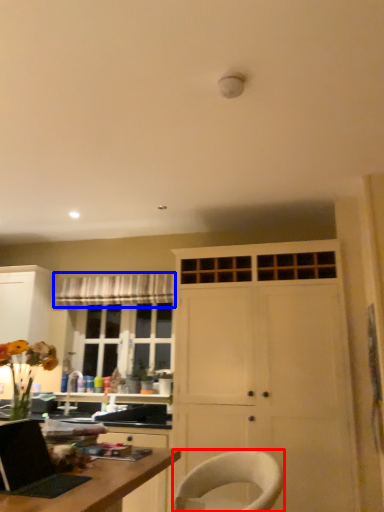
Question: Which object is further to the camera taking this photo, chair (highlighted by a red box) or curtain (highlighted by a blue box)?

Choices:
 (A) chair
 (B) curtain

Answer: (B)